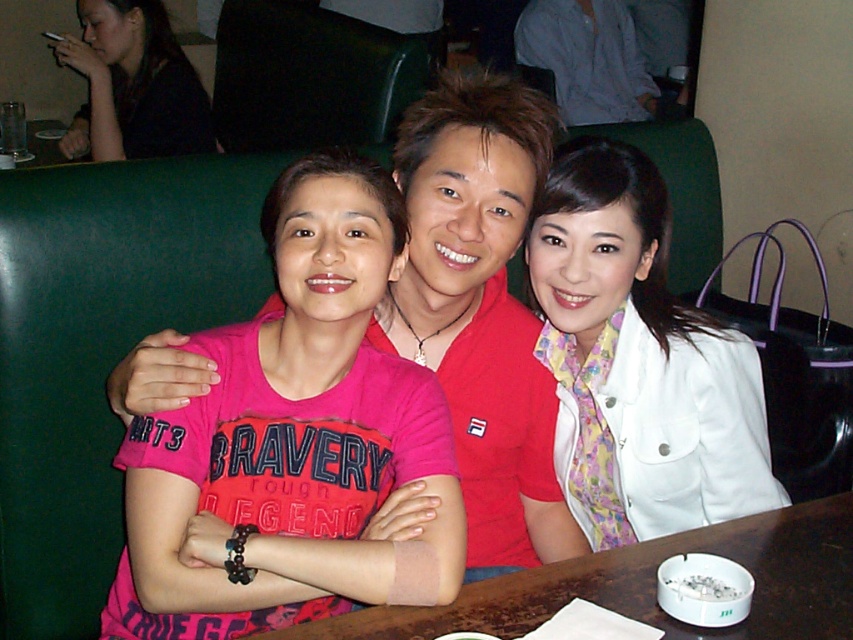
You are a photographer trying to capture a candid shot of the group. You notice the white satin jacket at upper right and the brown wooden table at center. Which object is positioned higher in the frame?

The white satin jacket at upper right is positioned higher in the frame than the brown wooden table at center.